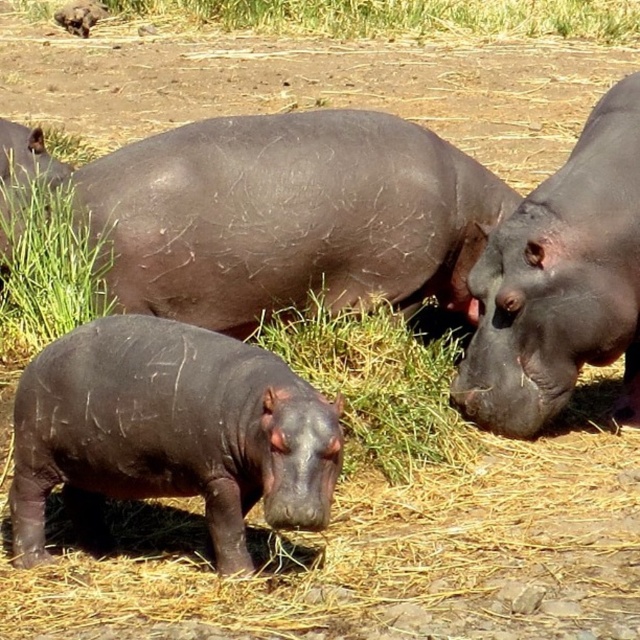
The image size is (640, 640). Find the location of `matte dark brown hippo at center`. matte dark brown hippo at center is located at coordinates (288, 216).

Is matte dark brown hippo at center further to camera compared to dark brown skin at upper left?

No, matte dark brown hippo at center is closer to the viewer.

Does point (200, 120) lie behind point (0, 289)?

That is True.

Where is `matte dark brown hippo at center`? This screenshot has height=640, width=640. matte dark brown hippo at center is located at coordinates (288, 216).

Can you confirm if shiny dark brown hippo at center is wider than green grass at lower left?

Yes, shiny dark brown hippo at center is wider than green grass at lower left.

Find the location of a particular element. The image size is (640, 640). shiny dark brown hippo at center is located at coordinates (561, 282).

Does point (10, 285) come behind point (61, 179)?

No, it is in front of (61, 179).

Does green grass at lower left have a greater height compared to dark brown skin at upper left?

Incorrect, green grass at lower left's height is not larger of dark brown skin at upper left's.

Is point (17, 288) farther from viewer compared to point (13, 131)?

No.

This screenshot has width=640, height=640. What are the coordinates of `green grass at lower left` in the screenshot? It's located at (45, 268).